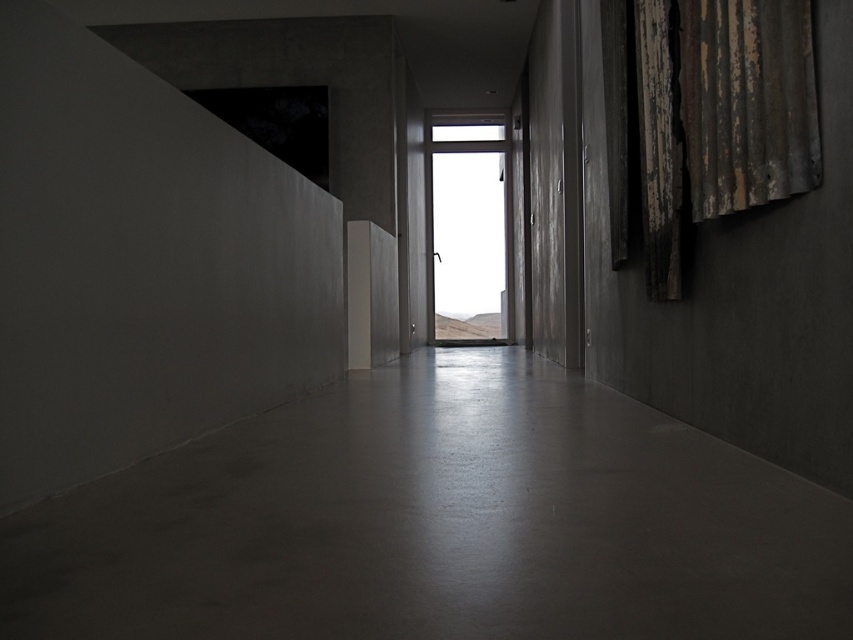
You are an interior designer assessing the corridor layout. You need to determine if the smooth concrete floor at center can accommodate a large rectangular rug that requires more space than the rusty corrugated metal curtain at right currently occupies. Based on the scene description, what should you advise?

The smooth concrete floor at center occupies less space than the rusty corrugated metal curtain at right. Therefore, the rug requiring more space than the rusty corrugated metal curtain at right cannot be placed on the smooth concrete floor at center since it has less available space.

You are a delivery person with a large box that is 2 meters wide. You need to move it through the corridor. The corridor has a smooth concrete floor at center and a transparent glass window at center. Which object in the corridor has a width that might be an issue for moving the box?

The transparent glass window at center has a greater width than the smooth concrete floor at center. Since the box is 2 meters wide, the width of the transparent glass window at center may be sufficient, but the smooth concrete floor at center is narrower. Therefore, the smooth concrete floor at center might be an issue for moving the box.

You are a delivery person carrying a tall package that is 2 meters in height. You need to walk through the corridor shown in the image. Based on the smooth concrete floor at center and the rusty corrugated metal curtain at right, which object might pose a height restriction for your package, and why?

The rusty corrugated metal curtain at right has a greater height than the smooth concrete floor at center. Since the package is 2 meters tall, the height of the curtain could be an issue if it is taller than the package, but since the floor is lower, the main concern would be the height of the curtain. However, the description only states the floor is lesser in height compared to the curtain, but without specific measurements, it is unclear if the curtain exceeds the package height. The answer should focus